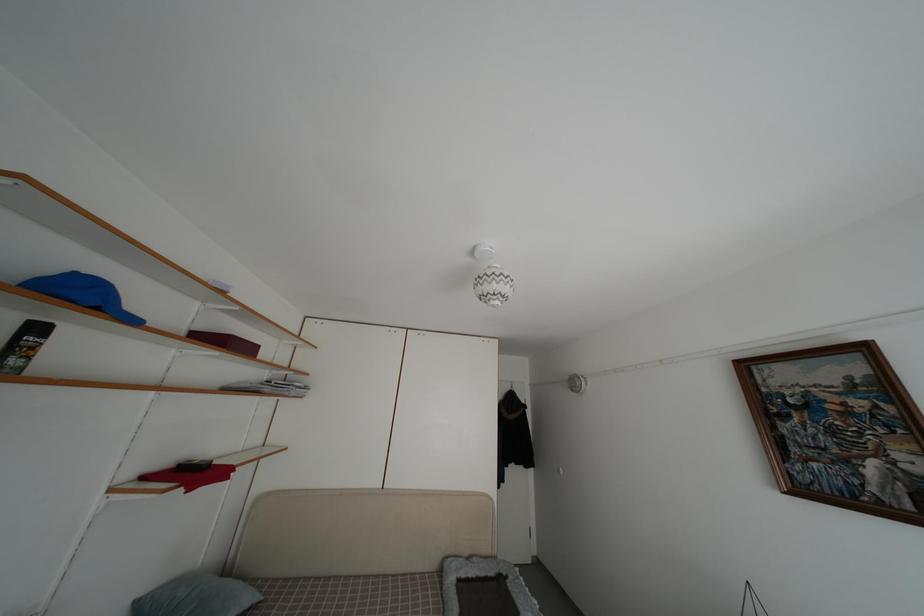
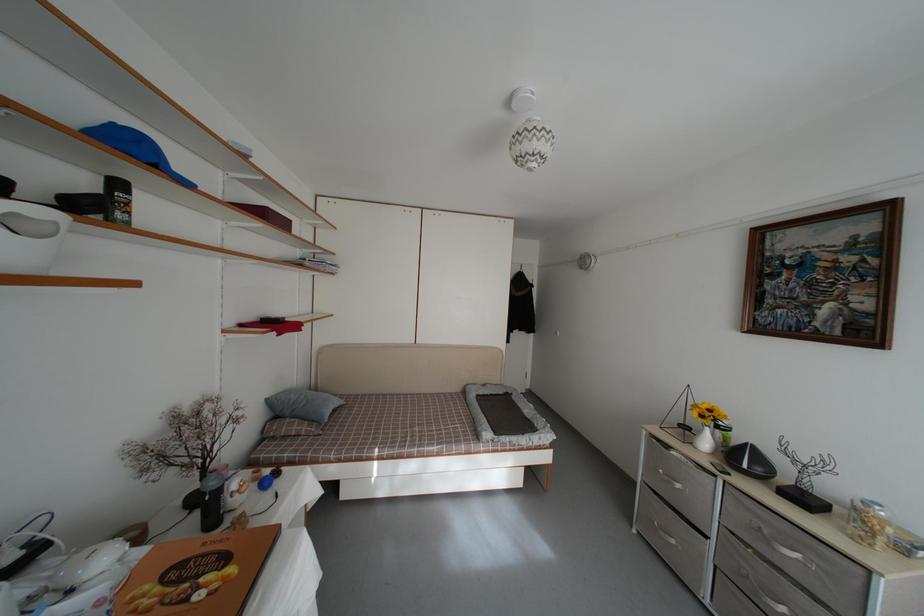
In the second image, find the point that corresponds to [506,586] in the first image.

(513, 402)